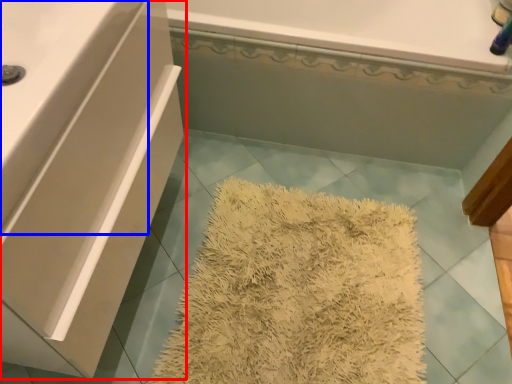
Question: Which point is closer to the camera, bathroom cabinet (highlighted by a red box) or counter top (highlighted by a blue box)?

Choices:
 (A) bathroom cabinet
 (B) counter top

Answer: (B)